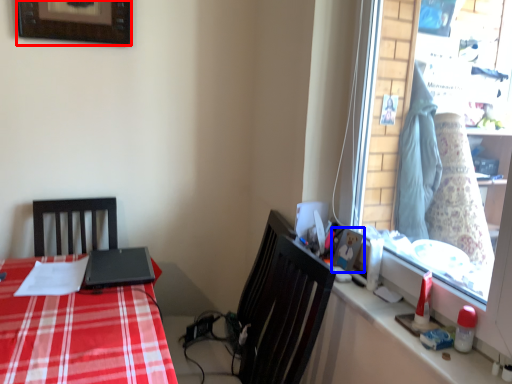
Question: Among these objects, which one is nearest to the camera, picture frame (highlighted by a red box) or picture frame (highlighted by a blue box)?

Choices:
 (A) picture frame
 (B) picture frame

Answer: (B)